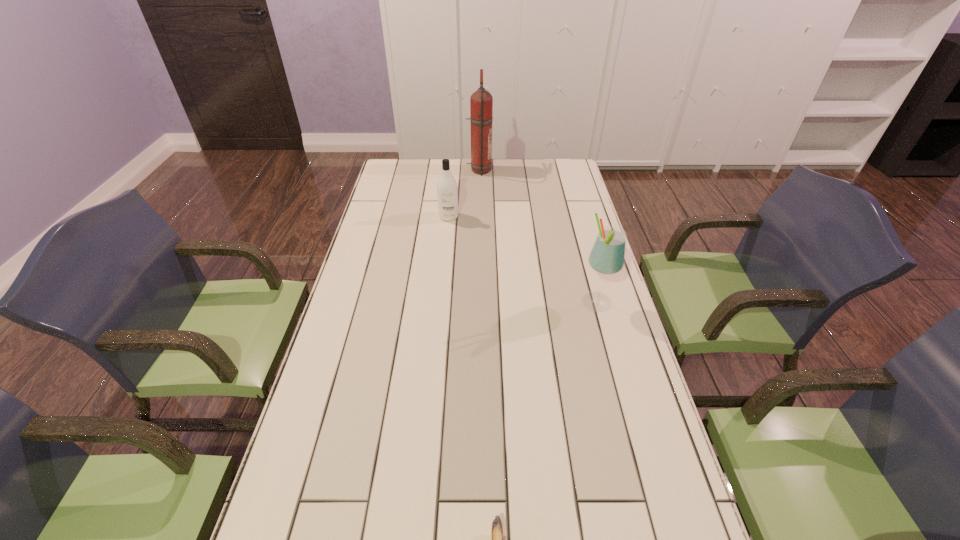
You are a GUI agent. You are given a task and a screenshot of the screen. Output one action in this format:
    pyautogui.click(x=<x>, y=<y>)
    Task: Click on the object at the right edge
    
    Given the screenshot: What is the action you would take?
    pyautogui.click(x=607, y=256)

Find the location of a particular element. free region at the left edge of the desktop is located at coordinates (372, 233).

The image size is (960, 540). In order to click on blank space at the right edge in this screenshot , I will do `click(595, 237)`.

Where is `vacant area at the far left corner of the desktop`? Image resolution: width=960 pixels, height=540 pixels. vacant area at the far left corner of the desktop is located at coordinates (394, 180).

Find the location of a particular element. Image resolution: width=960 pixels, height=540 pixels. vacant space at the far right corner of the desktop is located at coordinates point(577,177).

You are a GUI agent. You are given a task and a screenshot of the screen. Output one action in this format:
    pyautogui.click(x=<x>, y=<y>)
    Task: Click on the empty space that is in between the third nearest object and the alcohol
    
    Given the screenshot: What is the action you would take?
    pyautogui.click(x=522, y=260)

At what (x,y) coordinates should I click in order to perform the action: click on vacant point located between the third nearest object and the alcohol. Please return your answer as a coordinate pair (x, y). This screenshot has height=540, width=960. Looking at the image, I should click on (522, 260).

Image resolution: width=960 pixels, height=540 pixels. In order to click on free space between the second shortest object and the third shortest object in this screenshot , I will do point(522,260).

At what (x,y) coordinates should I click in order to perform the action: click on free area in between the rightmost object and the farthest object. Please return your answer as a coordinate pair (x, y). The width and height of the screenshot is (960, 540). Looking at the image, I should click on (538, 237).

Locate which object ranks third in proximity to the shortest object. Please provide its 2D coordinates. Your answer should be formatted as a tuple, i.e. [(x, y)], where the tuple contains the x and y coordinates of a point satisfying the conditions above.

[(481, 101)]